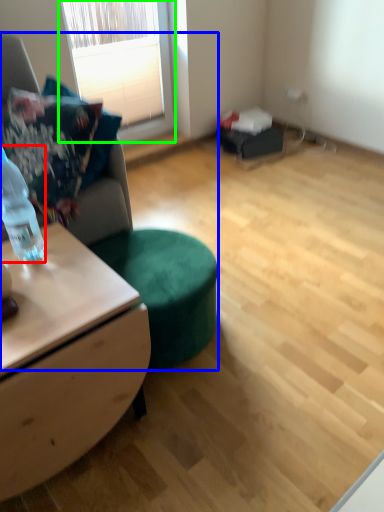
Question: Based on their relative distances, which object is nearer to bottle (highlighted by a red box)? Choose from studio couch (highlighted by a blue box) and window (highlighted by a green box).

Choices:
 (A) studio couch
 (B) window

Answer: (A)